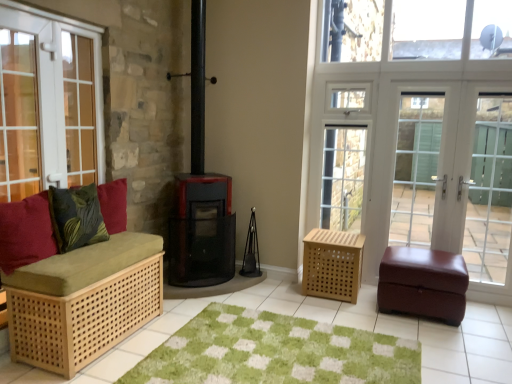
Locate an element on the screen. vacant point to the right of natural wood bench at left, the first furniture viewed from the left is located at coordinates (162, 326).